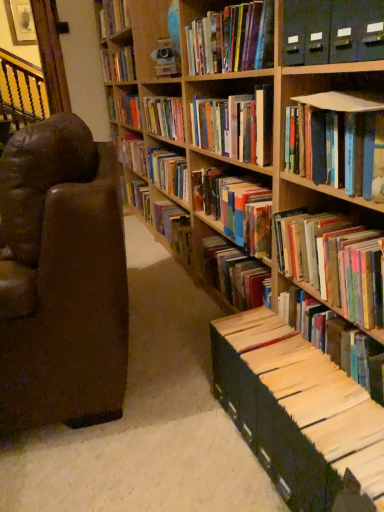
Question: Considering the relative sizes of brown leather chair at left and hardcover book at upper center, the third book when ordered from top to bottom, in the image provided, is brown leather chair at left wider than hardcover book at upper center, the third book when ordered from top to bottom,?

Choices:
 (A) no
 (B) yes

Answer: (B)

Question: Can you confirm if brown leather chair at left is taller than hardcover book at upper center, the third book when ordered from top to bottom?

Choices:
 (A) no
 (B) yes

Answer: (B)

Question: Can you confirm if brown leather chair at left is shorter than hardcover book at upper center, acting as the ninth book starting from the bottom?

Choices:
 (A) no
 (B) yes

Answer: (A)

Question: From a real-world perspective, is brown leather chair at left physically above hardcover book at upper center, the third book when ordered from top to bottom?

Choices:
 (A) yes
 (B) no

Answer: (B)

Question: Is brown leather chair at left positioned far away from hardcover book at upper center, acting as the ninth book starting from the bottom?

Choices:
 (A) no
 (B) yes

Answer: (B)

Question: Is point (173, 242) closer or farther from the camera than point (377, 395)?

Choices:
 (A) closer
 (B) farther

Answer: (B)

Question: From a real-world perspective, is hardcover book at center, which is counted as the ninth book, starting from the top, above or below white paper at lower right, which is counted as the eleventh book, starting from the top?

Choices:
 (A) below
 (B) above

Answer: (A)

Question: Is hardcover book at center, which is counted as the ninth book, starting from the top, wider or thinner than white paper at lower right, which is counted as the first book, starting from the bottom?

Choices:
 (A) thin
 (B) wide

Answer: (B)

Question: From the image's perspective, is hardcover book at center, which is counted as the ninth book, starting from the top, above or below white paper at lower right, which is counted as the first book, starting from the bottom?

Choices:
 (A) above
 (B) below

Answer: (A)

Question: Which is correct: brown leather chair at left is inside hardcover book at upper center, the 1th book positioned from the top, or outside of it?

Choices:
 (A) outside
 (B) inside

Answer: (A)

Question: Looking at their shapes, would you say brown leather chair at left is wider or thinner than hardcover book at upper center, the 11th book when ordered from bottom to top?

Choices:
 (A) wide
 (B) thin

Answer: (A)

Question: Considering the relative positions of brown leather chair at left and hardcover book at upper center, the 11th book when ordered from bottom to top, in the image provided, is brown leather chair at left to the left or to the right of hardcover book at upper center, the 11th book when ordered from bottom to top,?

Choices:
 (A) left
 (B) right

Answer: (B)

Question: From a real-world perspective, relative to hardcover book at upper center, the 11th book when ordered from bottom to top, is brown leather chair at left vertically above or below?

Choices:
 (A) below
 (B) above

Answer: (A)

Question: Considering the positions of point (246, 28) and point (208, 118), is point (246, 28) closer or farther from the camera than point (208, 118)?

Choices:
 (A) farther
 (B) closer

Answer: (B)

Question: From a real-world perspective, relative to hardcover book at upper center, which ranks as the 6th book in bottom-to-top order, is matte black file folders at upper right, acting as the 4th book starting from the top, vertically above or below?

Choices:
 (A) above
 (B) below

Answer: (A)